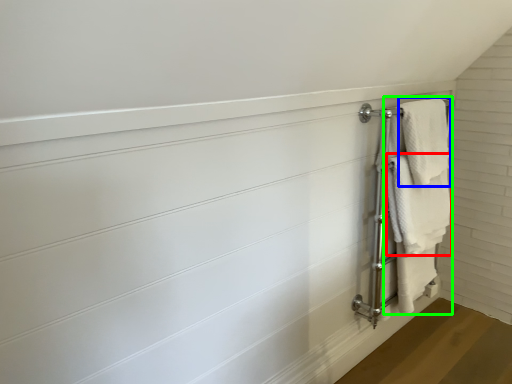
Question: Estimate the real-world distances between objects in this image. Which object is farther from towel (highlighted by a red box), bath towel (highlighted by a blue box) or bath towel (highlighted by a green box)?

Choices:
 (A) bath towel
 (B) bath towel

Answer: (A)